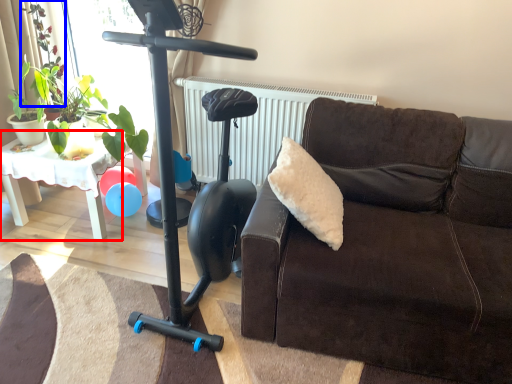
Question: Which point is further to the camera, table (highlighted by a red box) or plant (highlighted by a blue box)?

Choices:
 (A) table
 (B) plant

Answer: (B)